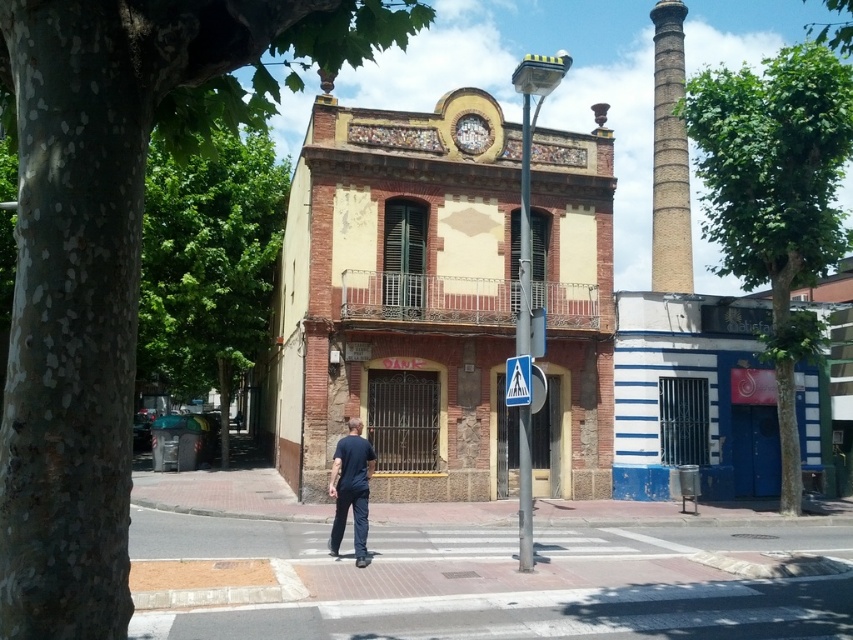
Does green leafy tree at right appear on the left side of gold textured clock at upper center?

No, green leafy tree at right is not to the left of gold textured clock at upper center.

What do you see at coordinates (775, 196) in the screenshot? I see `green leafy tree at right` at bounding box center [775, 196].

Which is in front, point (767, 160) or point (461, 150)?

Point (767, 160)

What are the coordinates of `green leafy tree at right` in the screenshot? It's located at (775, 196).

Does dark blue shirt at center have a lesser width compared to gold textured clock at upper center?

Yes.

Identify the location of dark blue shirt at center. The width and height of the screenshot is (853, 640). (351, 490).

Where is `dark blue shirt at center`? Image resolution: width=853 pixels, height=640 pixels. dark blue shirt at center is located at coordinates 351,490.

Is green leafy tree at left to the left of white plastic pedestrian crossing sign at center from the viewer's perspective?

Correct, you'll find green leafy tree at left to the left of white plastic pedestrian crossing sign at center.

This screenshot has width=853, height=640. Identify the location of green leafy tree at left. (112, 253).

Is point (24, 291) farther from viewer compared to point (503, 381)?

That is False.

Where is `green leafy tree at left`? Image resolution: width=853 pixels, height=640 pixels. green leafy tree at left is located at coordinates (112, 253).